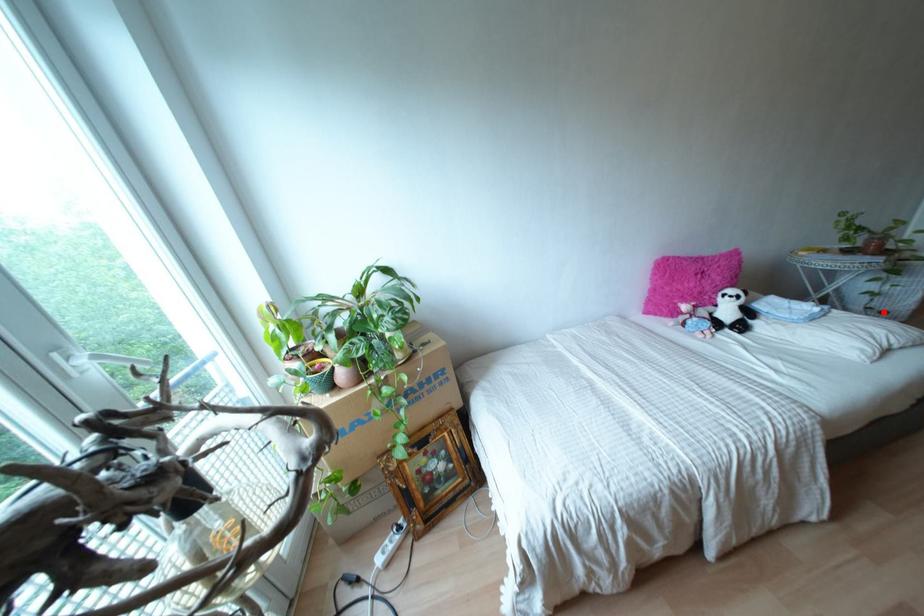
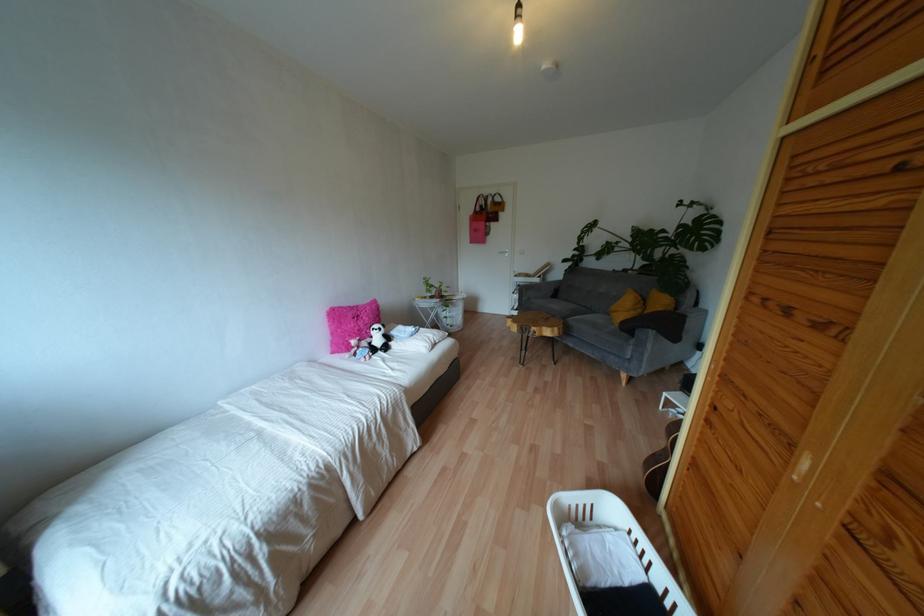
Where in the second image is the point corresponding to the highlighted location from the first image?

(450, 325)